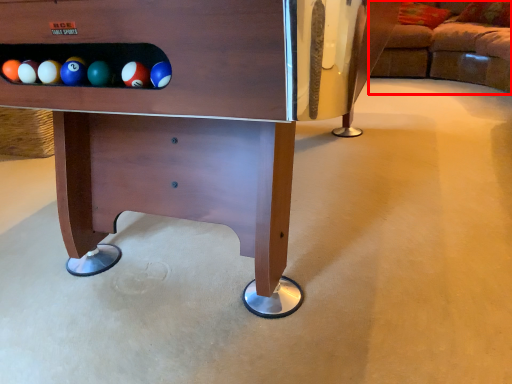
Question: From the image's perspective, what is the correct spatial positioning of studio couch (annotated by the red box) in reference to furniture?

Choices:
 (A) below
 (B) above

Answer: (B)